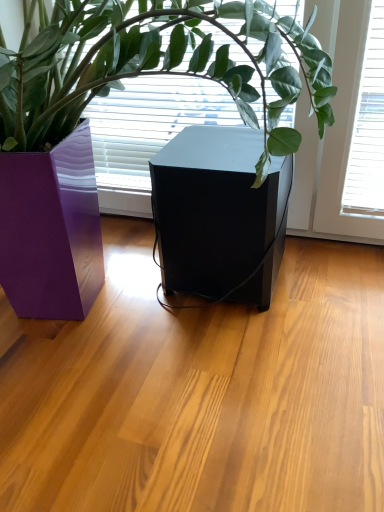
The height and width of the screenshot is (512, 384). I want to click on black matte speaker at center, so click(x=219, y=215).

What do you see at coordinates (219, 215) in the screenshot? The image size is (384, 512). I see `black matte speaker at center` at bounding box center [219, 215].

Identify the location of black matte speaker at center. Image resolution: width=384 pixels, height=512 pixels. (219, 215).